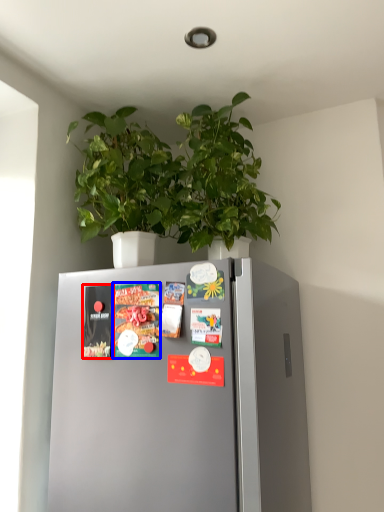
Question: Among these objects, which one is farthest to the camera, magazine (highlighted by a red box) or magazine (highlighted by a blue box)?

Choices:
 (A) magazine
 (B) magazine

Answer: (A)